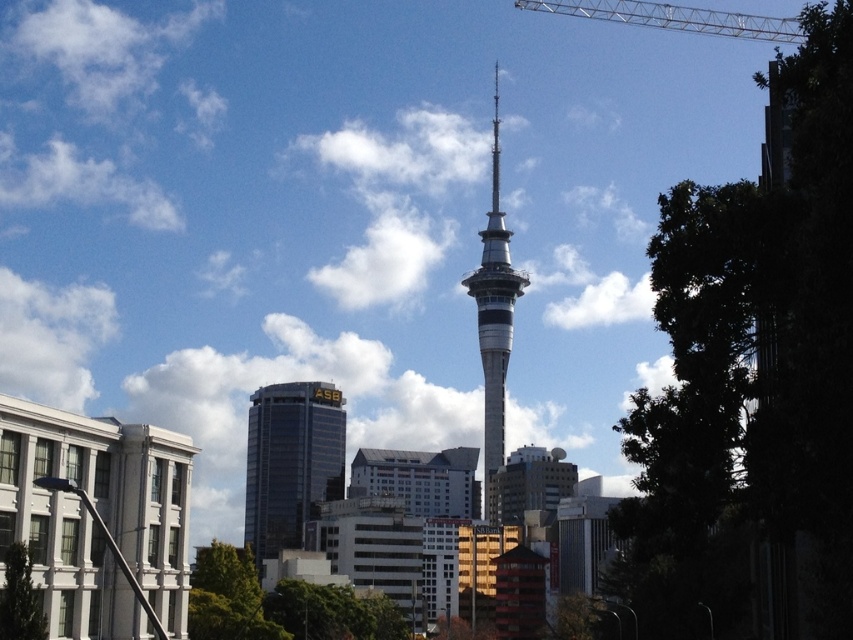
Question: Can you confirm if shiny glass skyscraper at center is positioned to the left of silver metallic tower at center?

Choices:
 (A) yes
 (B) no

Answer: (A)

Question: Can you confirm if silver metallic tower at center is positioned to the left of silver metallic crane at upper right?

Choices:
 (A) no
 (B) yes

Answer: (B)

Question: Considering the real-world distances, which object is farthest from the silver metallic crane at upper right?

Choices:
 (A) shiny glass skyscraper at center
 (B) silver metallic tower at center

Answer: (A)

Question: Considering the real-world distances, which object is farthest from the shiny glass skyscraper at center?

Choices:
 (A) silver metallic crane at upper right
 (B) silver metallic tower at center

Answer: (A)

Question: Where is silver metallic tower at center located in relation to silver metallic crane at upper right in the image?

Choices:
 (A) below
 (B) above

Answer: (A)

Question: Which of the following is the farthest from the observer?

Choices:
 (A) (764, 29)
 (B) (486, 268)

Answer: (A)